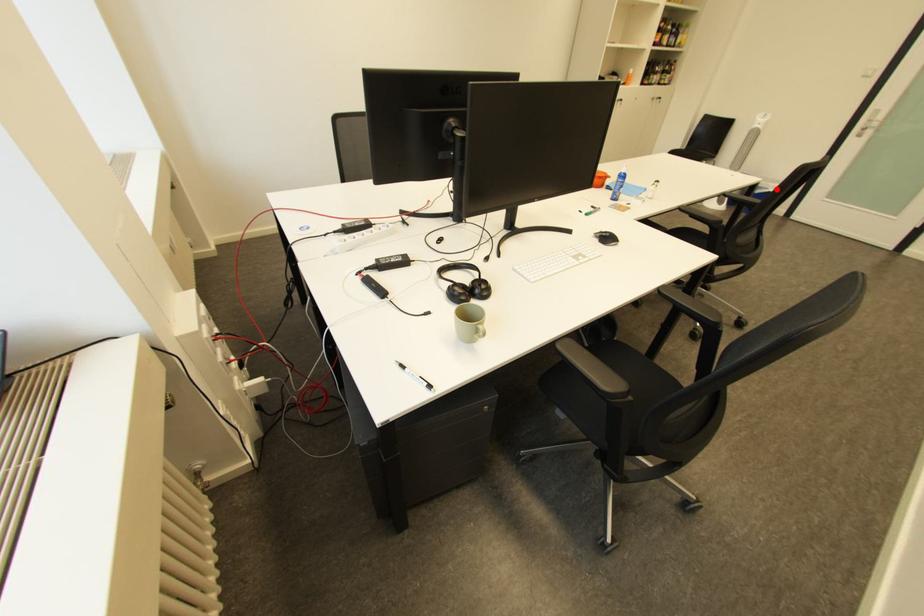
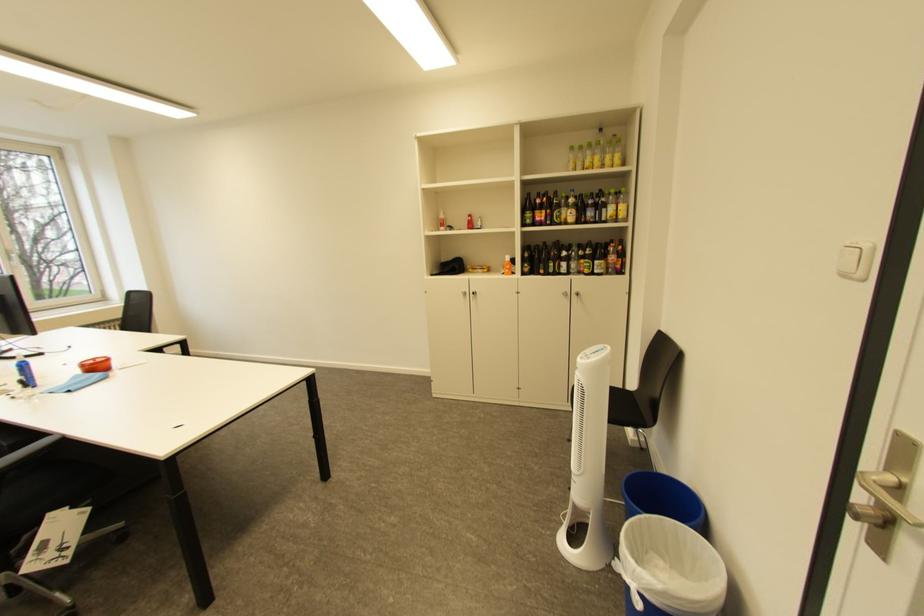
Where in the second image is the point corresponding to the highlighted location from the first image?

(636, 570)